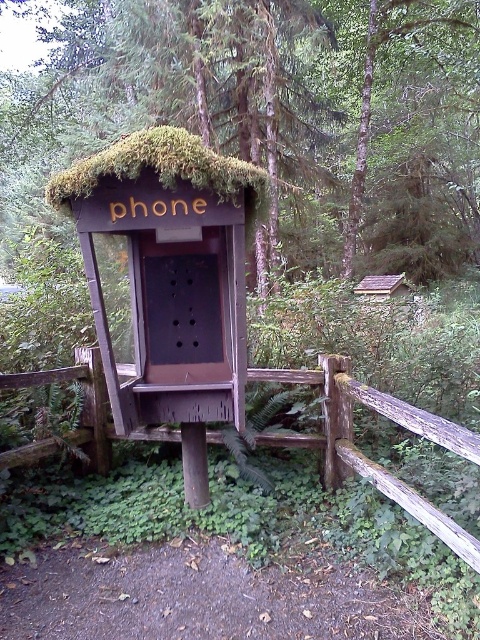
Question: Which object is farther from the camera taking this photo?

Choices:
 (A) wooden phone booth at center
 (B) brown wooden fence at center
 (C) wooden hut at center
 (D) green mossy roof at center

Answer: (C)

Question: Where is green mossy roof at center located in relation to brown wooden fence at center in the image?

Choices:
 (A) below
 (B) above

Answer: (B)

Question: Which point is closer to the camera taking this photo?

Choices:
 (A) click(389, 228)
 (B) click(92, 237)
 (C) click(278, 444)

Answer: (B)

Question: Which point is farther from the camera taking this photo?

Choices:
 (A) (389, 282)
 (B) (434, 232)
 (C) (240, 380)

Answer: (B)

Question: Is the position of wooden phone booth at center more distant than that of wooden hut at center?

Choices:
 (A) no
 (B) yes

Answer: (A)

Question: Considering the relative positions of green mossy roof at center and wooden phone booth at center in the image provided, where is green mossy roof at center located with respect to wooden phone booth at center?

Choices:
 (A) below
 (B) above

Answer: (B)